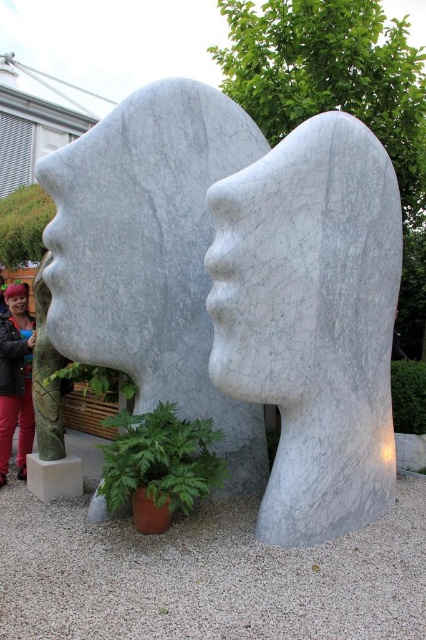
You are an art student analyzing the sculpture. You notice the white marble sculpture at center and the blonde hair at center. Which object is located above the other?

The blonde hair at center is above the white marble sculpture at center because the white marble sculpture at center is positioned under it.